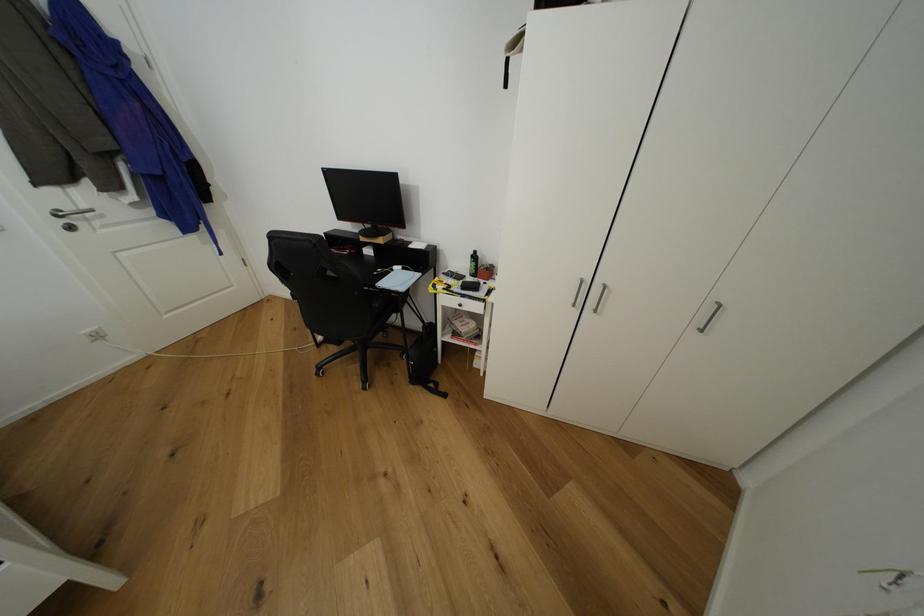
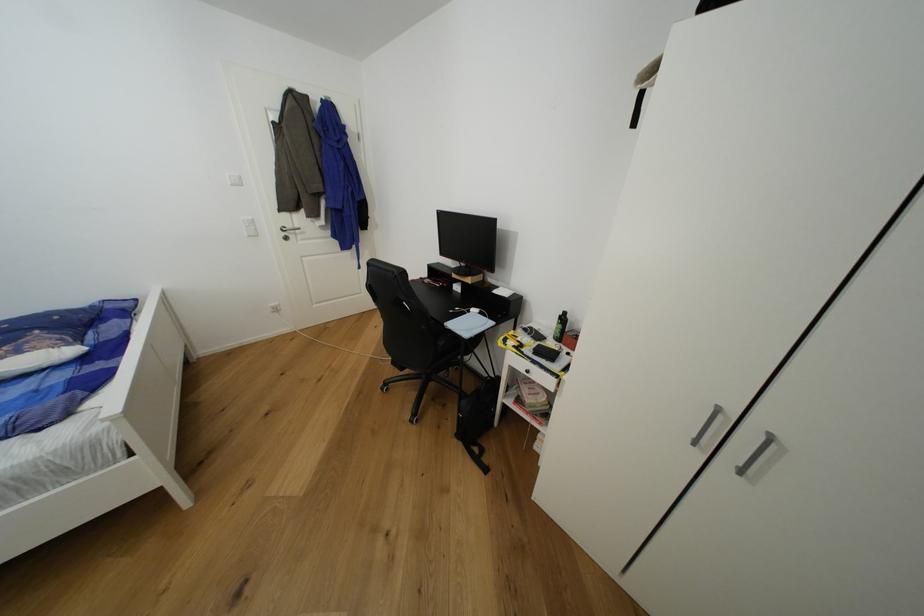
Question: The first image is from the beginning of the video and the second image is from the end. How did the camera likely rotate when shooting the video?

Choices:
 (A) Left
 (B) Right
 (C) Up
 (D) Down

Answer: (A)